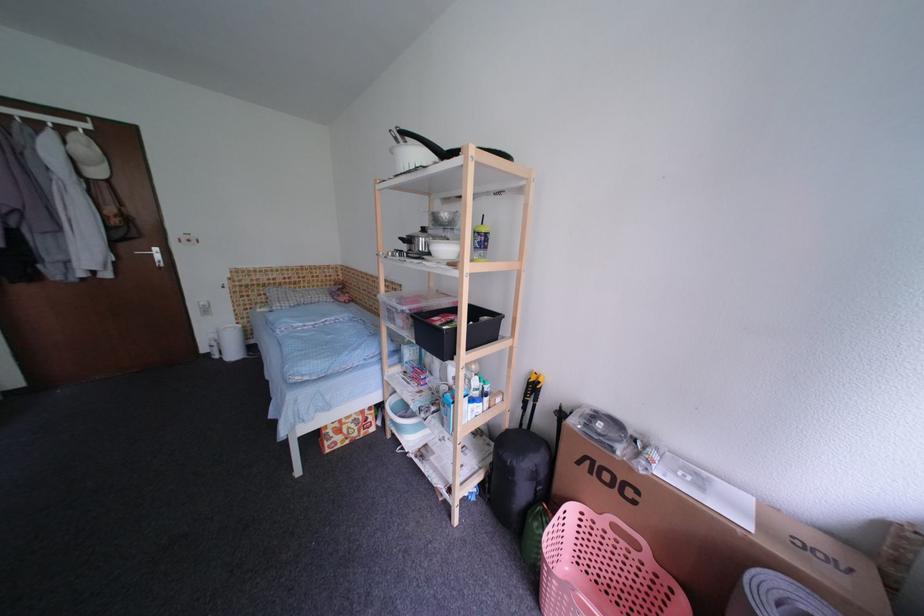
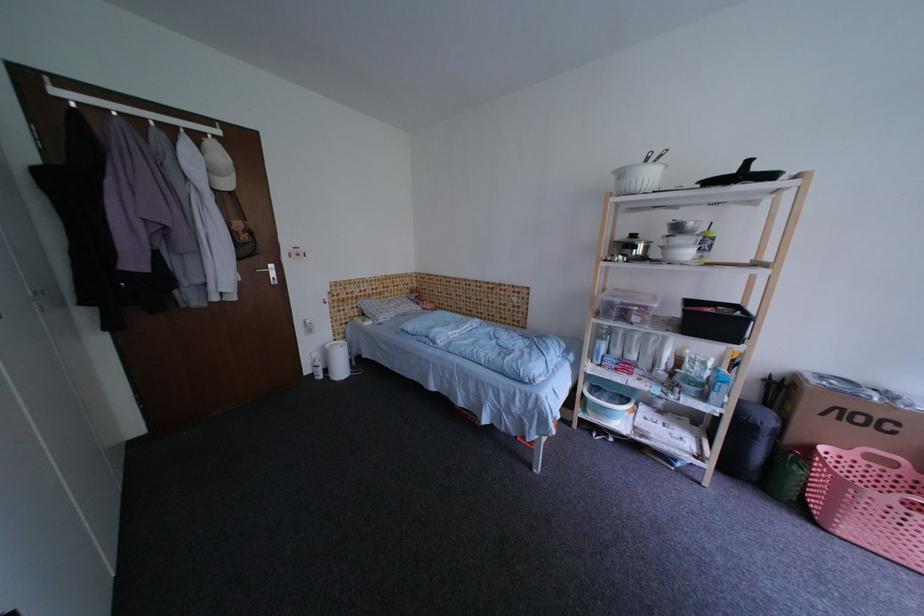
Question: The images are taken continuously from a first-person perspective. In which direction are you moving?

Choices:
 (A) Left
 (B) Right
 (C) Forward
 (D) Backward

Answer: (A)